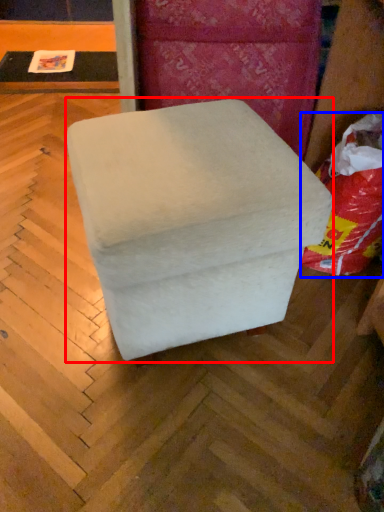
Question: Which of the following is the closest to the observer, furniture (highlighted by a red box) or bean bag chair (highlighted by a blue box)?

Choices:
 (A) furniture
 (B) bean bag chair

Answer: (A)